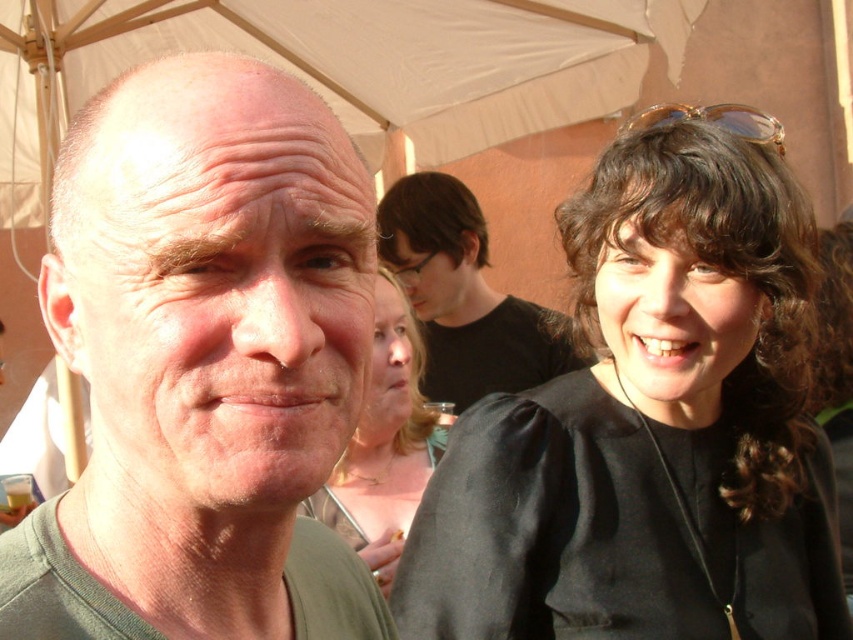
Question: Can you confirm if black matte shirt at upper right is wider than matte black dress at center?

Choices:
 (A) no
 (B) yes

Answer: (B)

Question: Estimate the real-world distances between objects in this image. Which object is closer to the matte black dress at center?

Choices:
 (A) black matte shirt at upper right
 (B) white fabric canopy at upper center
 (C) black matte shirt at center

Answer: (A)

Question: Which point is farther from the camera taking this photo?

Choices:
 (A) (479, 112)
 (B) (183, 404)
 (C) (619, 132)

Answer: (A)

Question: Is black matte shirt at center to the right of matte black dress at center from the viewer's perspective?

Choices:
 (A) no
 (B) yes

Answer: (B)

Question: Which object is the closest to the black matte shirt at center?

Choices:
 (A) translucent amber sunglasses at upper right
 (B) matte black dress at center
 (C) white fabric canopy at upper center

Answer: (C)

Question: Does green matte shirt at left have a greater width compared to white fabric canopy at upper center?

Choices:
 (A) yes
 (B) no

Answer: (B)